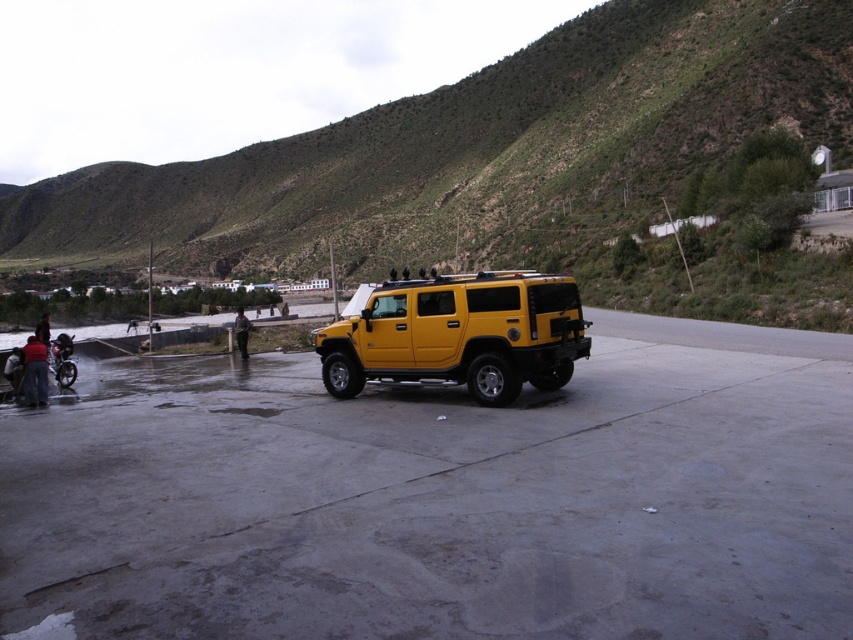
Does metallic silver motorcycle at lower left have a larger size compared to dark brown leather jacket at lower left?

Actually, metallic silver motorcycle at lower left might be smaller than dark brown leather jacket at lower left.

Where is `metallic silver motorcycle at lower left`? This screenshot has height=640, width=853. metallic silver motorcycle at lower left is located at coordinates (62, 360).

Can you confirm if red cotton shirt at lower left is thinner than metallic silver motorcycle at lower left?

Yes.

Which is behind, point (28, 394) or point (70, 352)?

The point (70, 352) is behind.

Locate an element on the screen. red cotton shirt at lower left is located at coordinates (35, 371).

Measure the distance between yellow matte suv at center and matte yellow suv at center.

yellow matte suv at center and matte yellow suv at center are 29.44 feet apart from each other.

Find the location of a particular element. This screenshot has height=640, width=853. yellow matte suv at center is located at coordinates (459, 333).

Does point (410, 289) come closer to viewer compared to point (65, 346)?

Yes, point (410, 289) is in front of point (65, 346).

Locate an element on the screen. The height and width of the screenshot is (640, 853). yellow matte suv at center is located at coordinates (459, 333).